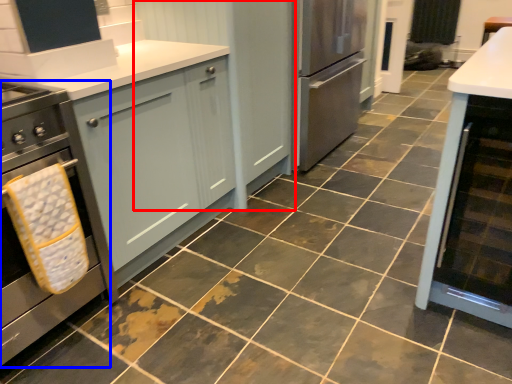
Question: Which object appears farthest to the camera in this image, cabinetry (highlighted by a red box) or home appliance (highlighted by a blue box)?

Choices:
 (A) cabinetry
 (B) home appliance

Answer: (A)